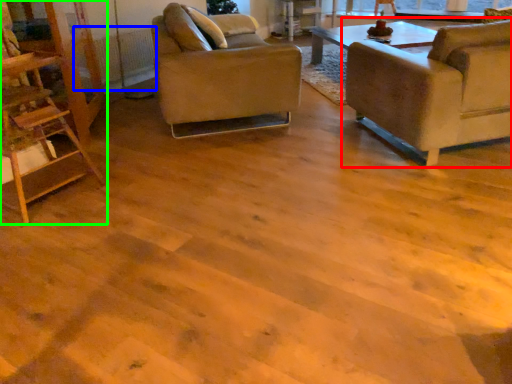
Question: Considering the real-world distances, which object is farthest from chair (highlighted by a red box)? radiator (highlighted by a blue box) or ladder (highlighted by a green box)?

Choices:
 (A) radiator
 (B) ladder

Answer: (A)